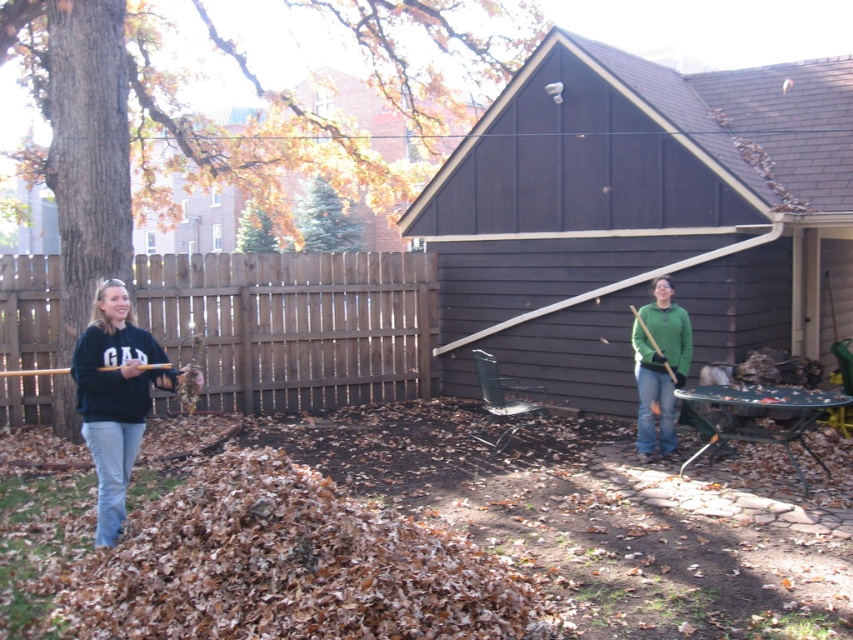
Is point (196, 336) farther from viewer compared to point (77, 404)?

Yes, point (196, 336) is farther from viewer.

Does brown wooden fence at center have a greater height compared to black sweatshirt at left?

Correct, brown wooden fence at center is much taller as black sweatshirt at left.

Locate an element on the screen. This screenshot has width=853, height=640. brown wooden fence at center is located at coordinates (294, 324).

Which is more to the left, brown wooden fence at center or green matte sweater at center?

From the viewer's perspective, brown wooden fence at center appears more on the left side.

Which of these two, brown wooden fence at center or green matte sweater at center, stands taller?

Standing taller between the two is brown wooden fence at center.

What do you see at coordinates (294, 324) in the screenshot?
I see `brown wooden fence at center` at bounding box center [294, 324].

Find the location of a particular element. The image size is (853, 640). brown wooden fence at center is located at coordinates (294, 324).

Does black sweatshirt at left appear over green matte sweater at center?

Incorrect, black sweatshirt at left is not positioned above green matte sweater at center.

Is point (105, 330) closer to viewer compared to point (688, 336)?

Yes.

Locate an element on the screen. black sweatshirt at left is located at coordinates (115, 396).